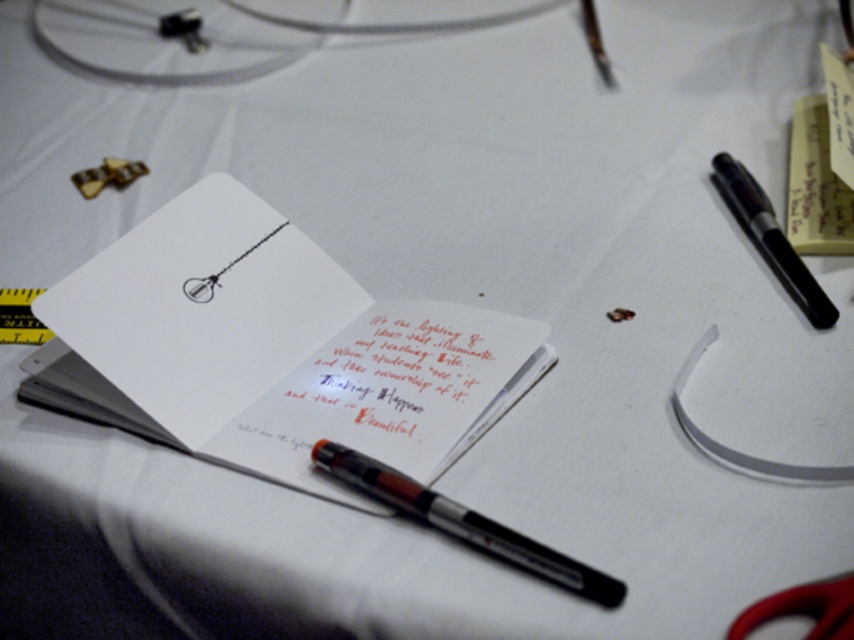
You are organizing your desk and need to place the yellow paper at upper right and the red plastic scissors at lower right into a drawer. The drawer has a height limit of 10 cm. Based on their sizes, can both items fit vertically in the drawer without bending or folding them?

The yellow paper at upper right is much taller than the red plastic scissors at lower right. Since the drawer has a height limit of 10 cm, if the yellow paper exceeds this height, it won

Consider the image. You are a student who needs to reach the white paper notepad at center on a desk. Your hand is currently 25 inches away from the notepad. Can you reach it without moving your chair?

The white paper notepad at center is 30.15 inches from the viewer. Since your hand is only 25 inches away, you cannot reach it without moving your chair.